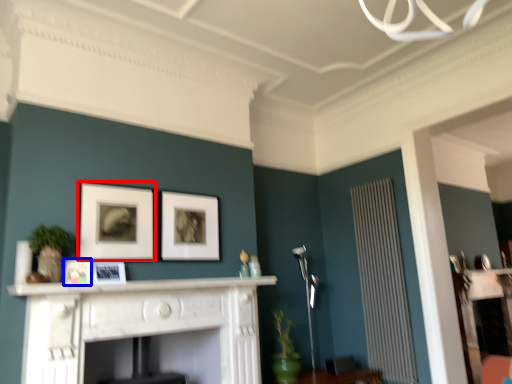
Question: Among these objects, which one is nearest to the camera, picture frame (highlighted by a red box) or picture frame (highlighted by a blue box)?

Choices:
 (A) picture frame
 (B) picture frame

Answer: (B)